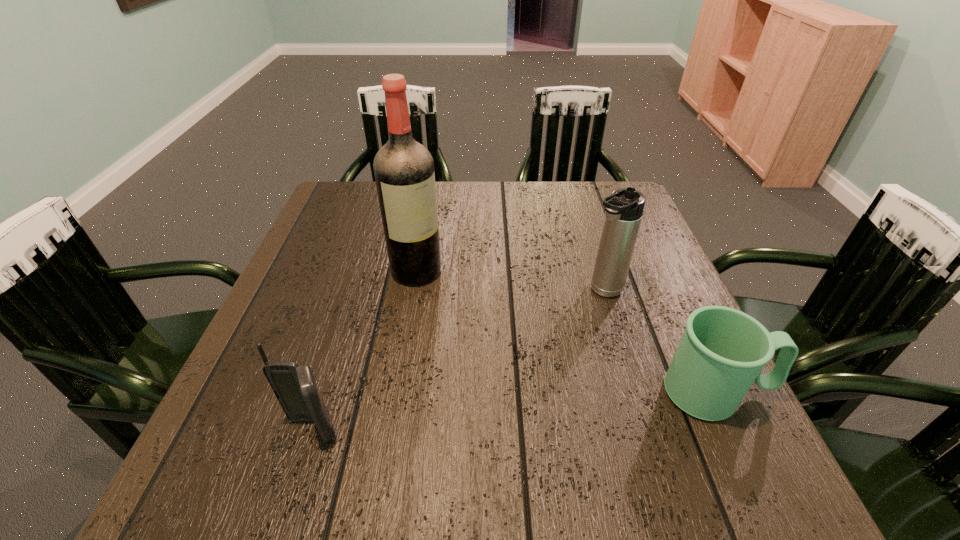
This screenshot has width=960, height=540. In order to click on free space between the mug and the second object from right to left in this screenshot , I will do `click(660, 342)`.

I want to click on free space between the third object from right to left and the mug, so click(x=566, y=332).

The image size is (960, 540). I want to click on free space between the cellular telephone and the rightmost object, so click(515, 411).

Locate an element on the screen. free space between the third object from left to right and the tallest object is located at coordinates (510, 281).

Find the location of a particular element. vacant space that is in between the second tallest object and the mug is located at coordinates (660, 342).

At what (x,y) coordinates should I click in order to perform the action: click on free space between the third object from right to left and the second object from right to left. Please return your answer as a coordinate pair (x, y). This screenshot has height=540, width=960. Looking at the image, I should click on (510, 281).

The image size is (960, 540). I want to click on object that stands as the third closest to the leftmost object, so click(x=722, y=352).

Choose which object is the second nearest neighbor to the rightmost object. Please provide its 2D coordinates. Your answer should be formatted as a tuple, i.e. [(x, y)], where the tuple contains the x and y coordinates of a point satisfying the conditions above.

[(404, 173)]

The image size is (960, 540). Identify the location of free location that satisfies the following two spatial constraints: 1. on the front side of the second tallest object; 2. on the side of the shortest object with the handle. (634, 393).

Locate an element on the screen. The width and height of the screenshot is (960, 540). free location that satisfies the following two spatial constraints: 1. on the front side of the third object from right to left; 2. on the right side of the second object from right to left is located at coordinates (413, 291).